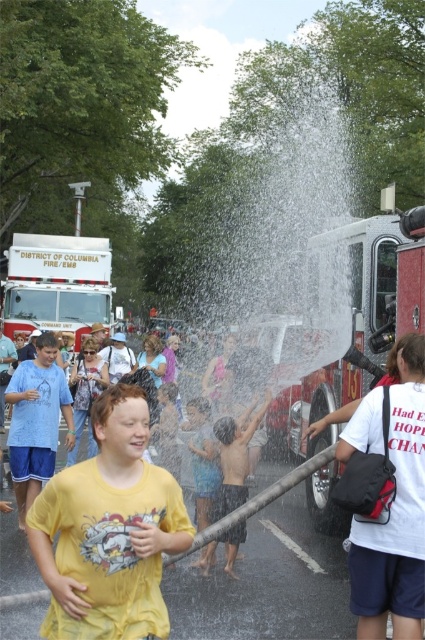
You are a photographer standing at the edge of the scene. You want to take a photo that includes both the yellow matte shirt at center and the matte blue shorts at left. The camera you are using has a maximum focus range of 4 meters. Will you be able to capture both subjects in focus without moving closer?

The yellow matte shirt at center is 4.05 meters away from the matte blue shorts at left. Since the distance between them is slightly over 4 meters, the camera might struggle to keep both in focus simultaneously without adjusting the focus or moving closer.

You are a photographer trying to capture the height difference between the shiny blue shorts at center and the blue denim shorts at center. Which one should you focus on to show the height difference clearly?

The shiny blue shorts at center is much taller than the blue denim shorts at center, so focusing on the shiny blue shorts at center will highlight its greater height compared to the blue denim shorts at center.

You are standing in the scene and want to take a photo of both the point at coordinates point (48, 401) and point (204, 470). Which point is closer to your camera lens?

Point (204, 470) is closer to the camera lens because it is less further than point (48, 401).